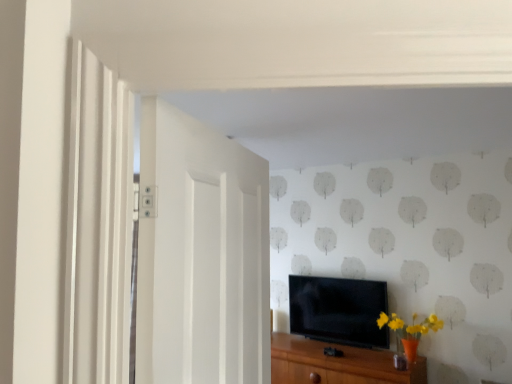
Question: From the image's perspective, relative to white painted wood door at left, is black glossy tv at center above or below?

Choices:
 (A) above
 (B) below

Answer: (B)

Question: Looking at the image, does black glossy tv at center seem bigger or smaller compared to white painted wood door at left?

Choices:
 (A) small
 (B) big

Answer: (A)

Question: Which object is the closest to the white painted wood door at left?

Choices:
 (A) black glossy tv at center
 (B) brown wood cabinet at lower center

Answer: (B)

Question: Estimate the real-world distances between objects in this image. Which object is farther from the white painted wood door at left?

Choices:
 (A) black glossy tv at center
 (B) brown wood cabinet at lower center

Answer: (A)